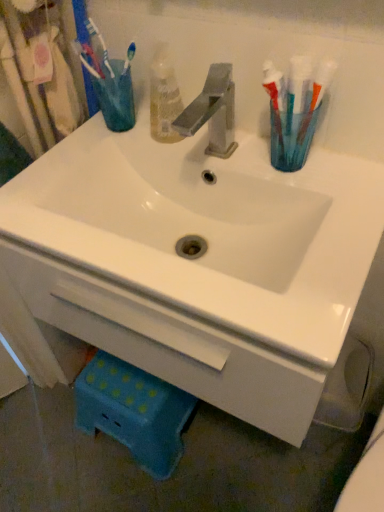
Question: Can you confirm if translucent plastic cup at upper left, which is the second turquoise in right-to-left order, is positioned to the right of white glossy sink at center?

Choices:
 (A) no
 (B) yes

Answer: (A)

Question: From a real-world perspective, is translucent plastic cup at upper left, which is counted as the 2th turquoise, starting from the front, on top of white glossy sink at center?

Choices:
 (A) yes
 (B) no

Answer: (A)

Question: Does translucent plastic cup at upper left, the 2th turquoise ordered from the bottom, have a lesser width compared to white glossy sink at center?

Choices:
 (A) yes
 (B) no

Answer: (A)

Question: From the image's perspective, is translucent plastic cup at upper left, which is counted as the 2th turquoise, starting from the front, beneath white glossy sink at center?

Choices:
 (A) no
 (B) yes

Answer: (A)

Question: Can you confirm if translucent plastic cup at upper left, which is the second turquoise in right-to-left order, is shorter than white glossy sink at center?

Choices:
 (A) no
 (B) yes

Answer: (B)

Question: From their relative heights in the image, would you say translucent plastic cup at upper left, which is counted as the 2th turquoise, starting from the front, is taller or shorter than translucent plastic toothbrush holder at upper right, which ranks as the 2th turquoise in back-to-front order?

Choices:
 (A) short
 (B) tall

Answer: (B)

Question: Would you say translucent plastic cup at upper left, which is the 1th turquoise in left-to-right order, is inside or outside translucent plastic toothbrush holder at upper right, the first turquoise positioned from the right?

Choices:
 (A) inside
 (B) outside

Answer: (B)

Question: Considering the positions of point (119, 122) and point (294, 119), is point (119, 122) closer or farther from the camera than point (294, 119)?

Choices:
 (A) closer
 (B) farther

Answer: (B)

Question: Considering the positions of translucent plastic cup at upper left, which is the second turquoise in right-to-left order, and translucent plastic toothbrush holder at upper right, which is counted as the first turquoise, starting from the front, in the image, is translucent plastic cup at upper left, which is the second turquoise in right-to-left order, wider or thinner than translucent plastic toothbrush holder at upper right, which is counted as the first turquoise, starting from the front,?

Choices:
 (A) thin
 (B) wide

Answer: (B)

Question: From a real-world perspective, relative to brushed metal toothbrush at upper left, is translucent plastic cup at upper left, which is counted as the 2th turquoise, starting from the front, vertically above or below?

Choices:
 (A) above
 (B) below

Answer: (B)

Question: In terms of height, does translucent plastic cup at upper left, the 2th turquoise ordered from the bottom, look taller or shorter compared to brushed metal toothbrush at upper left?

Choices:
 (A) tall
 (B) short

Answer: (B)

Question: Is translucent plastic cup at upper left, which is the second turquoise in right-to-left order, inside or outside of brushed metal toothbrush at upper left?

Choices:
 (A) outside
 (B) inside

Answer: (A)

Question: Would you say translucent plastic cup at upper left, which is the second turquoise in right-to-left order, is to the left or to the right of brushed metal toothbrush at upper left in the picture?

Choices:
 (A) left
 (B) right

Answer: (B)

Question: Do you think translucent plastic toothbrush holder at upper right, which appears as the first turquoise when ordered from the bottom, is within brushed metal toothbrush at upper left, or outside of it?

Choices:
 (A) outside
 (B) inside

Answer: (A)

Question: In the image, is translucent plastic toothbrush holder at upper right, which ranks as the 2th turquoise in back-to-front order, positioned in front of or behind brushed metal toothbrush at upper left?

Choices:
 (A) behind
 (B) front

Answer: (B)